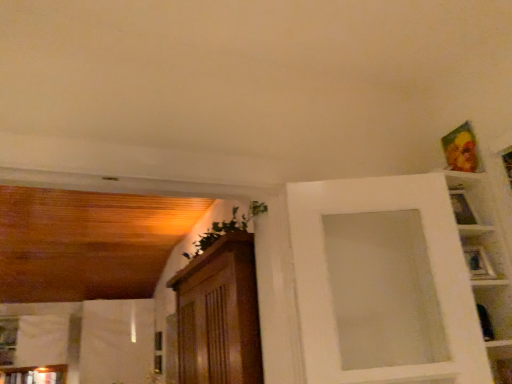
Question: Considering their positions, is metallic silver picture frame at upper right, marked as the 1th picture frame in a bottom-to-top arrangement, located in front of or behind metallic gold picture frame at upper right, which appears as the first picture frame when viewed from the top?

Choices:
 (A) front
 (B) behind

Answer: (A)

Question: From the image's perspective, relative to metallic gold picture frame at upper right, the second picture frame when ordered from front to back, is metallic silver picture frame at upper right, placed as the 2th picture frame when sorted from top to bottom, above or below?

Choices:
 (A) below
 (B) above

Answer: (A)

Question: From their relative heights in the image, would you say metallic silver picture frame at upper right, placed as the 2th picture frame when sorted from top to bottom, is taller or shorter than metallic gold picture frame at upper right, the 2th picture frame from the bottom?

Choices:
 (A) short
 (B) tall

Answer: (A)

Question: Considering the positions of point (471, 132) and point (470, 274), is point (471, 132) closer or farther from the camera than point (470, 274)?

Choices:
 (A) closer
 (B) farther

Answer: (B)

Question: From a real-world perspective, is metallic gold picture frame at upper right, which appears as the first picture frame when viewed from the top, positioned above or below metallic silver picture frame at upper right, placed as the 2th picture frame when sorted from top to bottom?

Choices:
 (A) below
 (B) above

Answer: (B)

Question: In terms of size, does metallic gold picture frame at upper right, the second picture frame when ordered from front to back, appear bigger or smaller than metallic silver picture frame at upper right, marked as the 1th picture frame in a bottom-to-top arrangement?

Choices:
 (A) big
 (B) small

Answer: (A)

Question: Considering their positions, is metallic gold picture frame at upper right, acting as the first picture frame starting from the back, located in front of or behind metallic silver picture frame at upper right, marked as the 1th picture frame in a bottom-to-top arrangement?

Choices:
 (A) behind
 (B) front

Answer: (A)